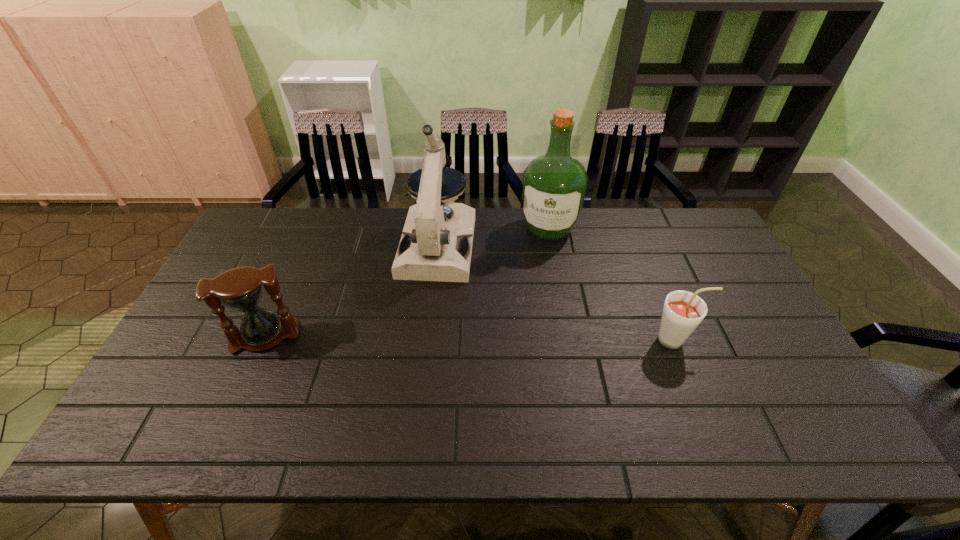
Where is `vacant space at the far left corner of the desktop`? This screenshot has width=960, height=540. vacant space at the far left corner of the desktop is located at coordinates (243, 251).

Where is `vacant space that's between the second object from right to left and the root beer`? The height and width of the screenshot is (540, 960). vacant space that's between the second object from right to left and the root beer is located at coordinates (612, 284).

Find the location of a particular element. free space between the third object from left to right and the hourglass is located at coordinates (407, 283).

Locate an element on the screen. The height and width of the screenshot is (540, 960). free space between the leftmost object and the rightmost object is located at coordinates (470, 339).

Where is `free space between the leftmost object and the microscope`? This screenshot has width=960, height=540. free space between the leftmost object and the microscope is located at coordinates (351, 291).

Find the location of a particular element. vacant space that is in between the third tallest object and the microscope is located at coordinates (351, 291).

I want to click on blank region between the shortest object and the second object from right to left, so click(612, 284).

Where is `free space between the leftmost object and the third object from right to left`? The image size is (960, 540). free space between the leftmost object and the third object from right to left is located at coordinates (351, 291).

The width and height of the screenshot is (960, 540). I want to click on vacant area between the microscope and the rightmost object, so click(x=557, y=293).

This screenshot has height=540, width=960. Find the location of `unoccupied area between the root beer and the microscope`. unoccupied area between the root beer and the microscope is located at coordinates (557, 293).